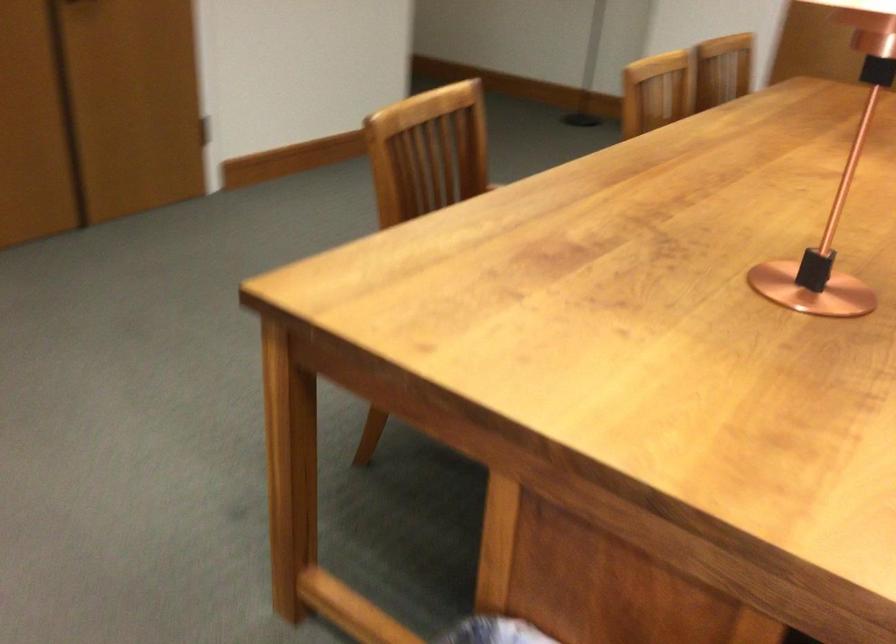
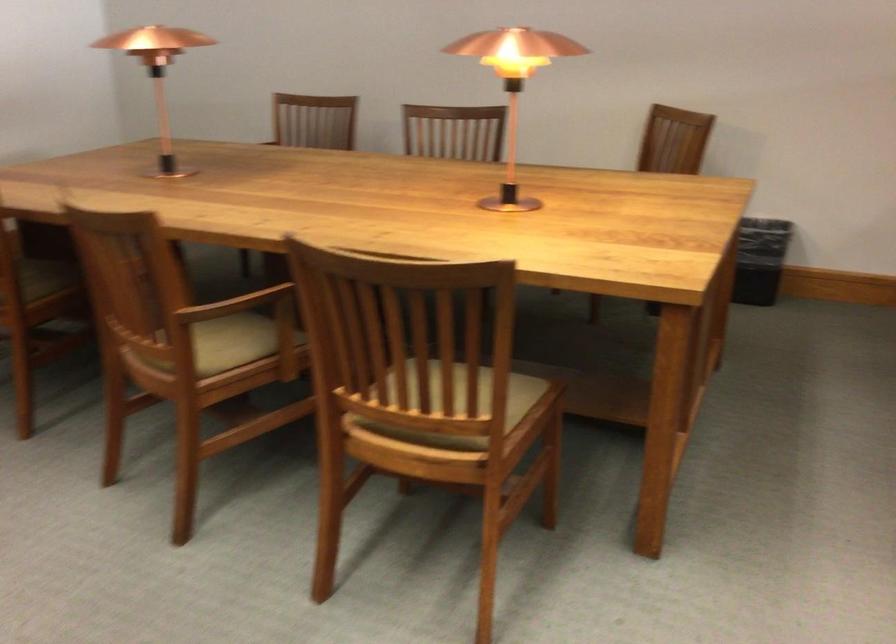
The first image is from the beginning of the video and the second image is from the end. How did the camera likely rotate when shooting the video?

The rotation direction of the camera is right-down.